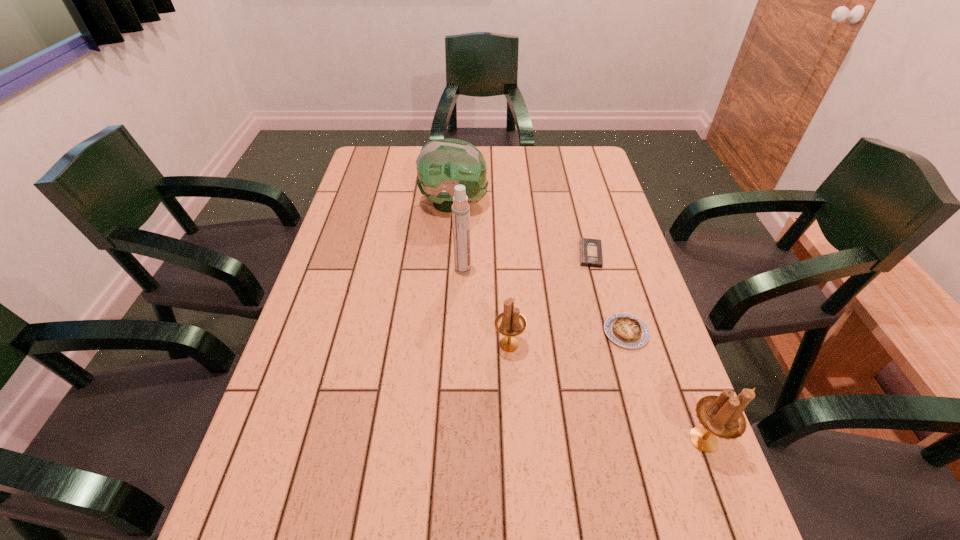
Where is `free region located on the front of the tallest object`? free region located on the front of the tallest object is located at coordinates (462, 288).

Identify the location of vacant space located on the visor of the football helmet. (548, 204).

Locate an element on the screen. vacant region located on the back of the quiche is located at coordinates (601, 246).

At what (x,y) coordinates should I click in order to perform the action: click on free spot located on the back of the videotape. Please return your answer as a coordinate pair (x, y). Image resolution: width=960 pixels, height=540 pixels. Looking at the image, I should click on (572, 186).

At what (x,y) coordinates should I click in order to perform the action: click on object that is at the near edge. Please return your answer as a coordinate pair (x, y). The image size is (960, 540). Looking at the image, I should click on (722, 416).

Identify the location of candle holder that is at the right edge. tap(722, 416).

Find the location of `quiche at the right edge`. quiche at the right edge is located at coordinates (626, 330).

Locate an element on the screen. The width and height of the screenshot is (960, 540). videotape that is at the right edge is located at coordinates (591, 255).

You are a GUI agent. You are given a task and a screenshot of the screen. Output one action in this format:
    pyautogui.click(x=<x>, y=<y>)
    Task: Click on the object located in the near right corner section of the desktop
    The width and height of the screenshot is (960, 540).
    Given the screenshot: What is the action you would take?
    click(722, 416)

Where is `free region at the far edge of the desktop`? free region at the far edge of the desktop is located at coordinates (520, 156).